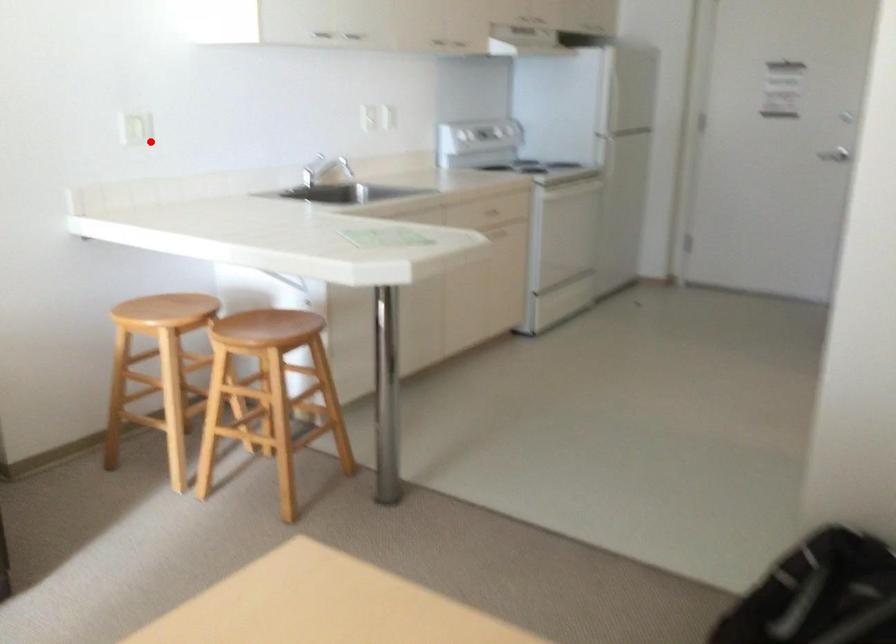
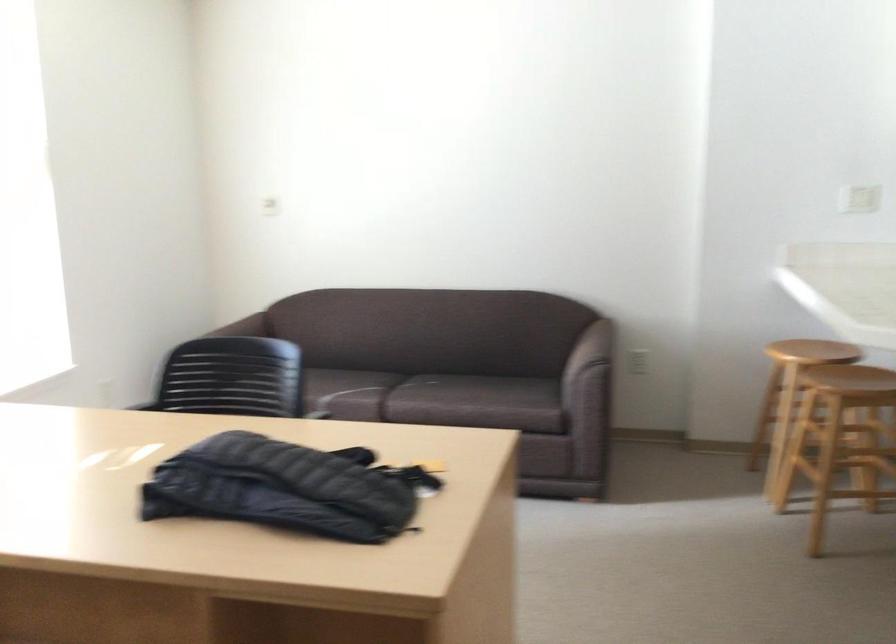
The point at the highlighted location is marked in the first image. Where is the corresponding point in the second image?

(858, 198)